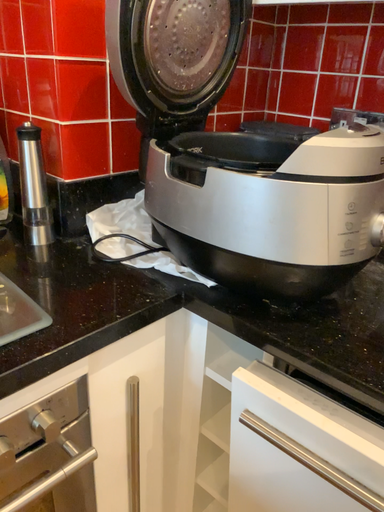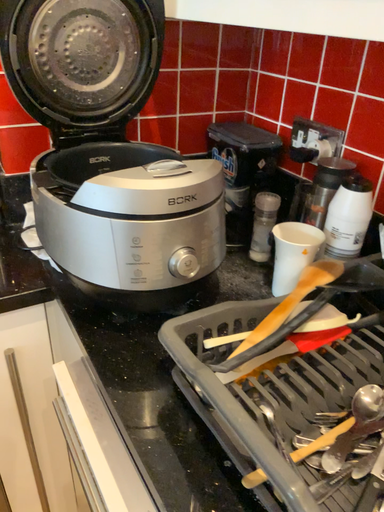
Question: How did the camera likely rotate when shooting the video?

Choices:
 (A) rotated right
 (B) rotated left

Answer: (B)